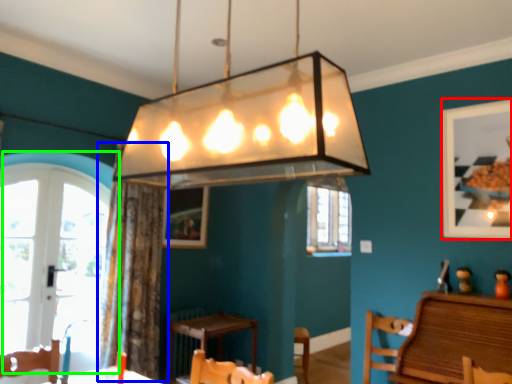
Question: Based on their relative distances, which object is farther from picture frame (highlighted by a red box)? Choose from curtain (highlighted by a blue box) and window (highlighted by a green box).

Choices:
 (A) curtain
 (B) window

Answer: (B)